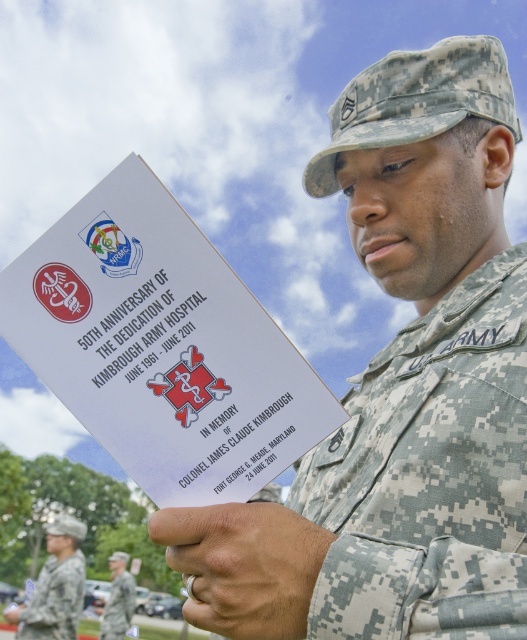
Who is positioned more to the left, camouflage fabric us army uniform at center or matte camouflage ring at lower center?

matte camouflage ring at lower center

Does camouflage fabric us army uniform at center appear on the left side of matte camouflage ring at lower center?

Incorrect, camouflage fabric us army uniform at center is not on the left side of matte camouflage ring at lower center.

The image size is (527, 640). What are the coordinates of `camouflage fabric us army uniform at center` in the screenshot? It's located at (430, 476).

Can you confirm if camouflage fabric uniform at lower left is positioned below camouflage fabric uniform at center?

Actually, camouflage fabric uniform at lower left is above camouflage fabric uniform at center.

Does camouflage fabric uniform at lower left appear on the right side of camouflage fabric uniform at center?

No, camouflage fabric uniform at lower left is not to the right of camouflage fabric uniform at center.

The image size is (527, 640). What are the coordinates of `camouflage fabric uniform at lower left` in the screenshot? It's located at coord(54,600).

Where is `camouflage fabric uniform at lower left`? Image resolution: width=527 pixels, height=640 pixels. camouflage fabric uniform at lower left is located at coordinates (54, 600).

Can you confirm if camouflage fabric us army uniform at center is positioned below camouflage fabric uniform at center?

Actually, camouflage fabric us army uniform at center is above camouflage fabric uniform at center.

Based on the photo, between camouflage fabric us army uniform at center and camouflage fabric uniform at center, which one has more height?

Standing taller between the two is camouflage fabric uniform at center.

Is point (409, 570) positioned in front of point (111, 609)?

Yes, point (409, 570) is in front of point (111, 609).

The height and width of the screenshot is (640, 527). I want to click on camouflage fabric us army uniform at center, so click(430, 476).